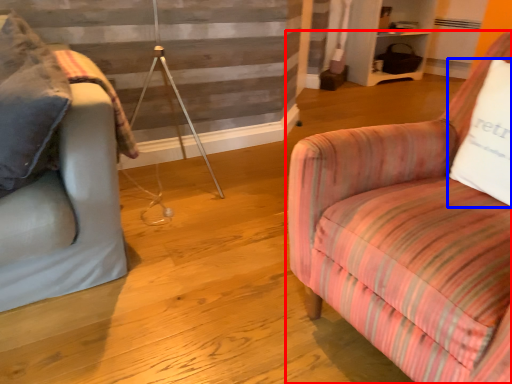
Question: Which object appears closest to the camera in this image, chair (highlighted by a red box) or pillow (highlighted by a blue box)?

Choices:
 (A) chair
 (B) pillow

Answer: (A)